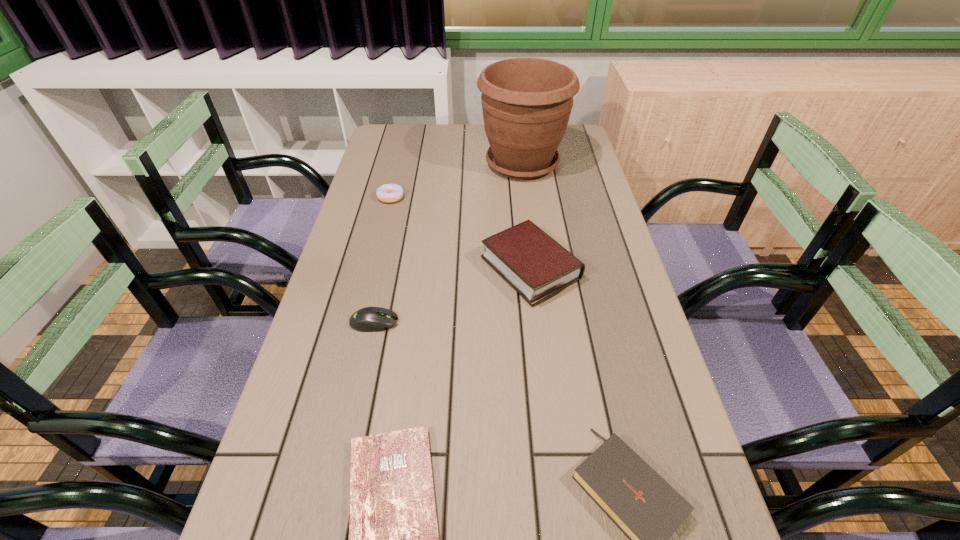
What are the coordinates of `object that is at the far edge` in the screenshot? It's located at (526, 102).

Identify the location of doughnut that is at the left edge. Image resolution: width=960 pixels, height=540 pixels. (389, 193).

Where is `computer mouse that is at the left edge`? computer mouse that is at the left edge is located at coordinates (369, 319).

Locate an element on the screen. flowerpot located in the right edge section of the desktop is located at coordinates (526, 102).

Image resolution: width=960 pixels, height=540 pixels. I want to click on Bible that is positioned at the right edge, so click(527, 258).

Image resolution: width=960 pixels, height=540 pixels. Identify the location of object positioned at the far right corner. (526, 102).

Image resolution: width=960 pixels, height=540 pixels. In order to click on vacant space at the far edge of the desktop in this screenshot , I will do `click(442, 125)`.

In the image, there is a desktop. What are the coordinates of `vacant space at the left edge` in the screenshot? It's located at (347, 304).

This screenshot has height=540, width=960. Identify the location of vacant region at the right edge of the desktop. (706, 503).

At what (x,y) coordinates should I click in order to perform the action: click on vacant space in between the fourth farthest object and the second farthest object. Please return your answer as a coordinate pair (x, y). This screenshot has height=540, width=960. Looking at the image, I should click on coord(383,260).